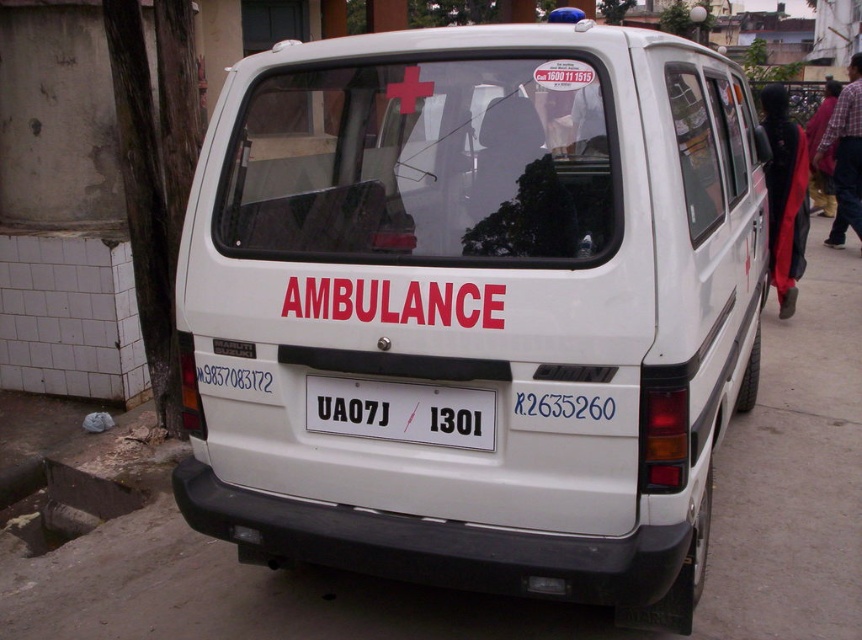
Does white matte van at center appear on the right side of white plastic license plate at center?

Yes, white matte van at center is to the right of white plastic license plate at center.

Looking at this image, which of these two, white matte van at center or white plastic license plate at center, stands taller?

white matte van at center is taller.

At what (x,y) coordinates should I click in order to perform the action: click on white matte van at center. Please return your answer as a coordinate pair (x, y). The height and width of the screenshot is (640, 862). Looking at the image, I should click on (476, 305).